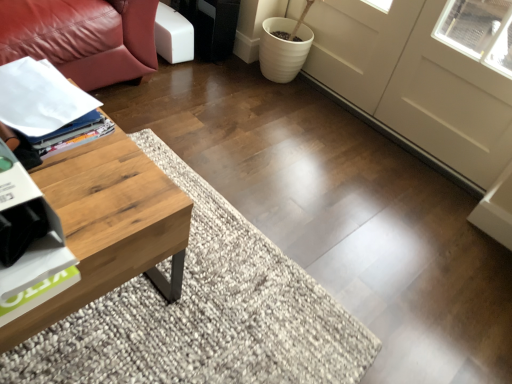
Identify the location of free location to the right of woodenmaterial/texturecoffee table at left. (219, 305).